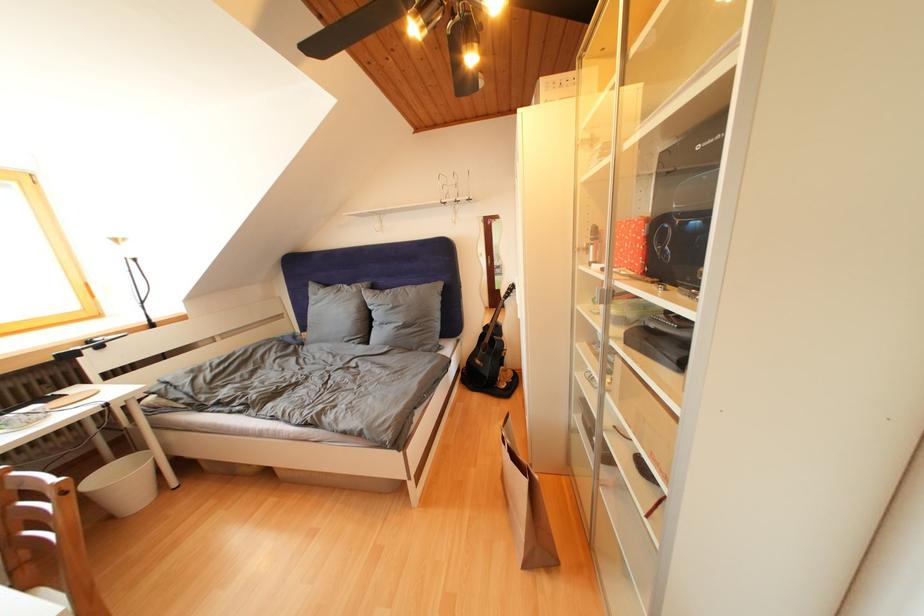
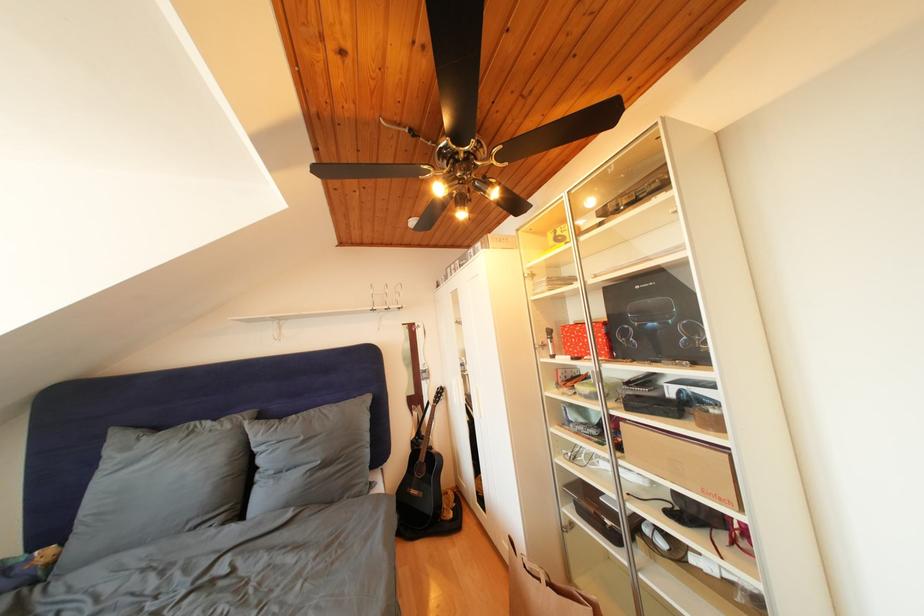
How did the camera likely rotate?

The camera rotated toward right-up.